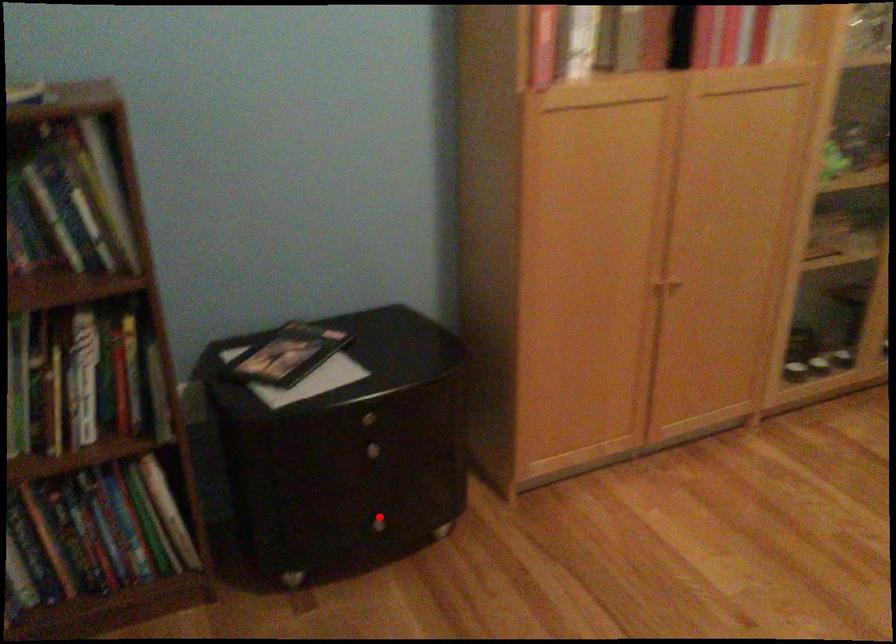
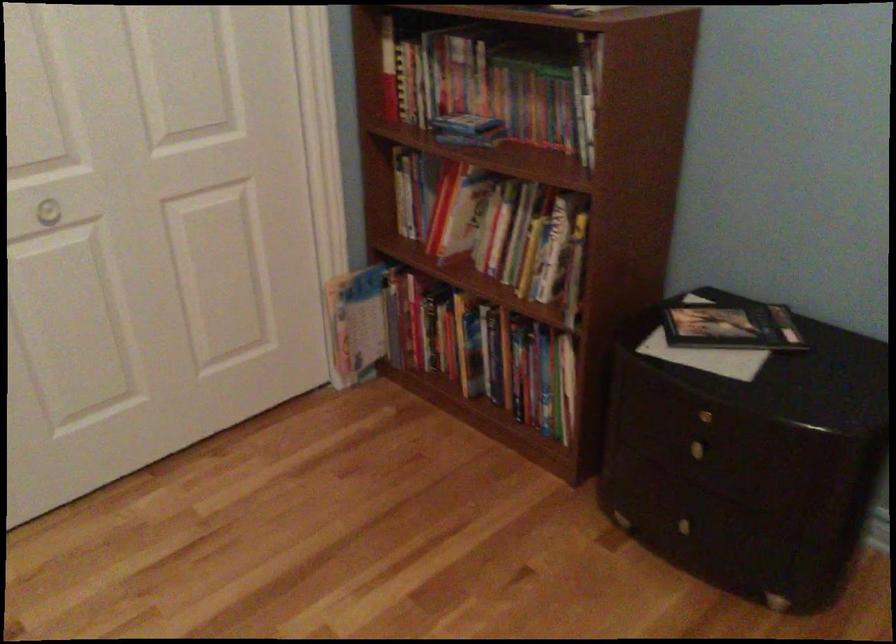
Locate, in the second image, the point that corresponds to the highlighted location in the first image.

(690, 518)